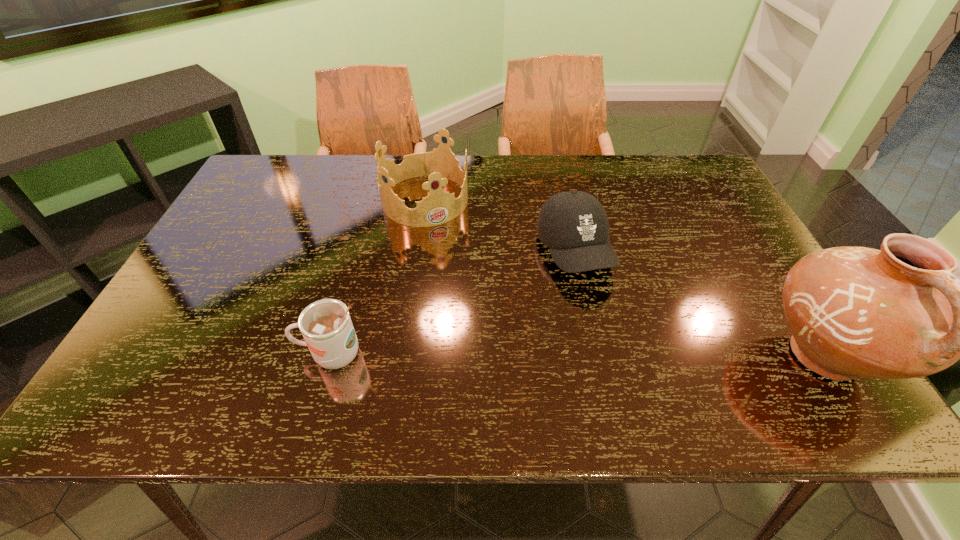
Where is `vacant space situated on the front-facing side of the tiara`? vacant space situated on the front-facing side of the tiara is located at coordinates (493, 319).

The height and width of the screenshot is (540, 960). I want to click on free region located on the front-facing side of the third object from left to right, so click(610, 329).

Identify the location of vacant space situated on the front-facing side of the third object from left to right. (608, 325).

What are the coordinates of `free space located on the front-facing side of the third object from left to right` in the screenshot? It's located at (601, 312).

At what (x,y) coordinates should I click in order to perform the action: click on object that is at the far edge. Please return your answer as a coordinate pair (x, y). Looking at the image, I should click on (440, 165).

Image resolution: width=960 pixels, height=540 pixels. Find the location of `cup that is at the near edge`. cup that is at the near edge is located at coordinates (326, 326).

Where is `pottery located in the near edge section of the desktop`? The height and width of the screenshot is (540, 960). pottery located in the near edge section of the desktop is located at coordinates tap(896, 313).

Identify the location of object at the right edge. The width and height of the screenshot is (960, 540). (896, 313).

Where is `object at the near right corner`? object at the near right corner is located at coordinates (896, 313).

Locate an element on the screen. This screenshot has width=960, height=540. vacant space at the far edge is located at coordinates (323, 195).